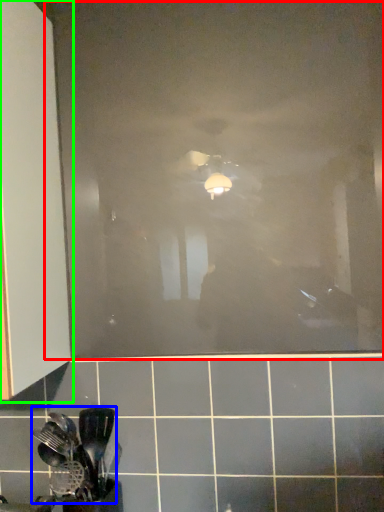
Question: Considering the real-world distances, which object is closest to glass door (highlighted by a red box)? spatula (highlighted by a blue box) or cabinetry (highlighted by a green box).

Choices:
 (A) spatula
 (B) cabinetry

Answer: (B)